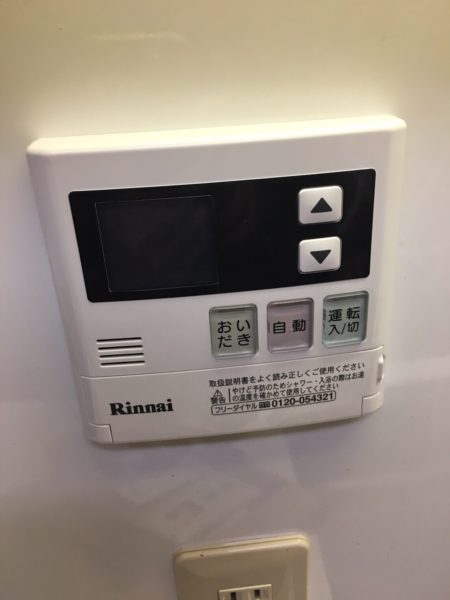
Where is `vent`? This screenshot has height=600, width=450. vent is located at coordinates (122, 339), (111, 346), (117, 355), (125, 365).